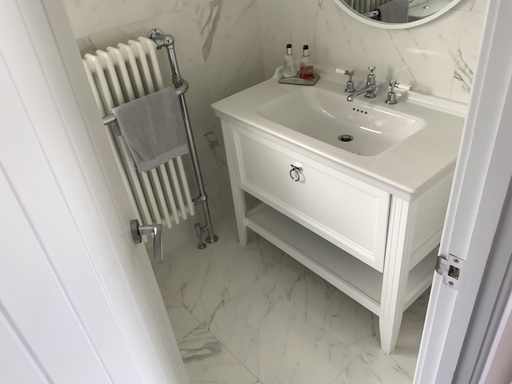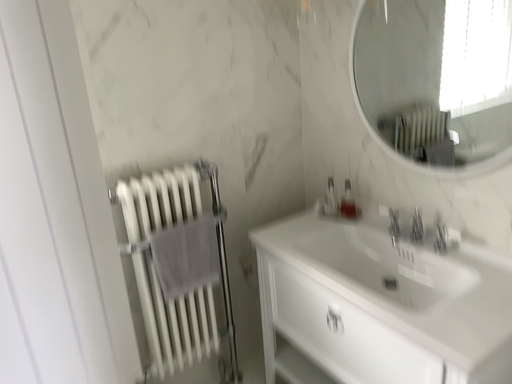
Question: How did the camera likely rotate when shooting the video?

Choices:
 (A) rotated upward
 (B) rotated downward

Answer: (A)